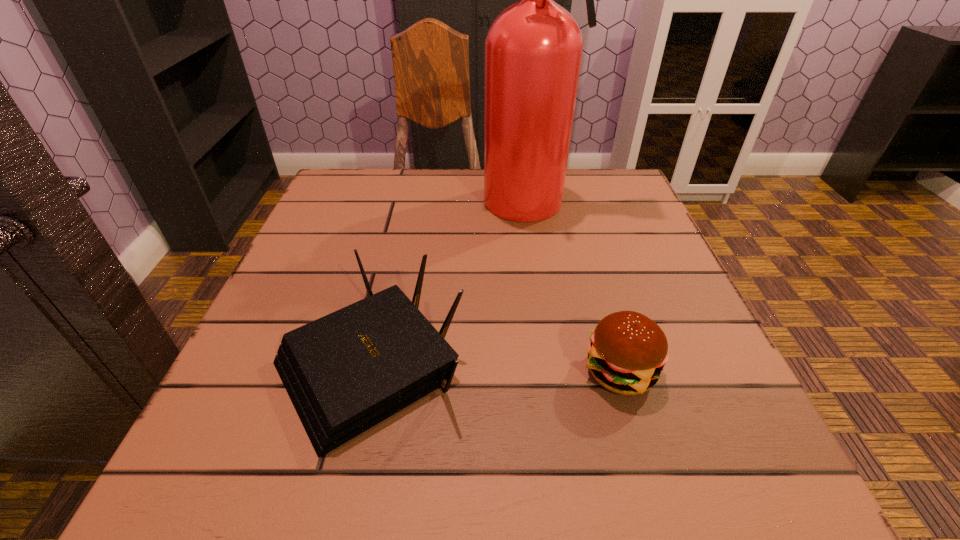
Where is `vacant area at the near left corner of the desktop`? This screenshot has width=960, height=540. vacant area at the near left corner of the desktop is located at coordinates (298, 474).

You are a GUI agent. You are given a task and a screenshot of the screen. Output one action in this format:
    pyautogui.click(x=<x>, y=<y>)
    Task: Click on the vacant space at the far right corner
    This screenshot has width=960, height=540.
    Given the screenshot: What is the action you would take?
    pyautogui.click(x=588, y=188)

Locate an element on the screen. The image size is (960, 540). vacant area at the near right corner of the desktop is located at coordinates (678, 440).

At what (x,y) coordinates should I click in order to perform the action: click on blank region between the tallest object and the router. Please return your answer as a coordinate pair (x, y). The width and height of the screenshot is (960, 540). Looking at the image, I should click on pyautogui.click(x=453, y=284).

The height and width of the screenshot is (540, 960). In order to click on vacant space that is in between the hamburger and the farthest object in this screenshot , I will do `click(579, 287)`.

At what (x,y) coordinates should I click in order to perform the action: click on vacant area between the leftmost object and the fire extinguisher. Please return your answer as a coordinate pair (x, y). Image resolution: width=960 pixels, height=540 pixels. Looking at the image, I should click on (453, 284).

Identify the location of free spot between the tallest object and the shortest object. This screenshot has width=960, height=540. (579, 287).

The height and width of the screenshot is (540, 960). I want to click on free space between the hamburger and the router, so click(x=494, y=368).

Locate an element on the screen. free spot between the second shortest object and the shortest object is located at coordinates (494, 368).

At what (x,y) coordinates should I click in order to perform the action: click on vacant region between the tallest object and the shortest object. Please return your answer as a coordinate pair (x, y). Looking at the image, I should click on (579, 287).